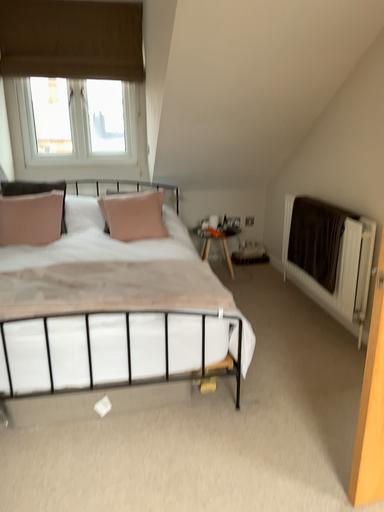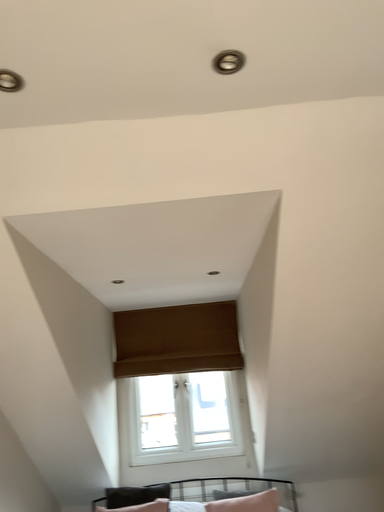
Question: Which way did the camera rotate in the video?

Choices:
 (A) rotated upward
 (B) rotated downward

Answer: (A)